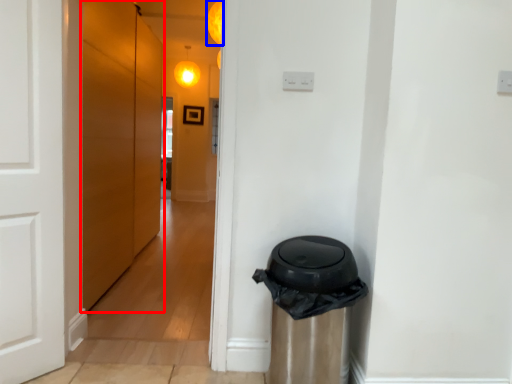
Question: Which point is closer to the camera, door (highlighted by a red box) or light (highlighted by a blue box)?

Choices:
 (A) door
 (B) light

Answer: (A)